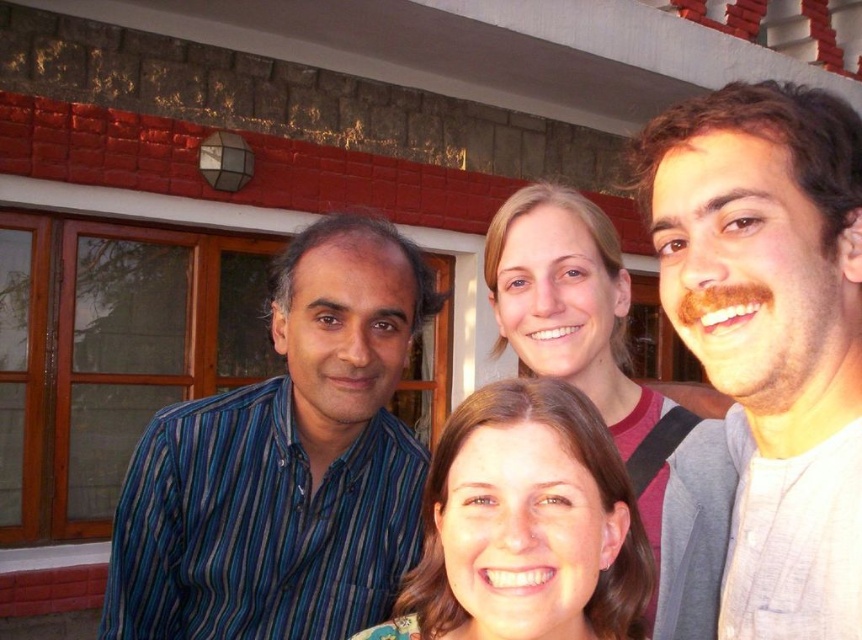
You are a photographer trying to adjust the focus on your camera. You want to ensure that both the blue striped shirt at left and the gray cotton shirt at right are in clear focus. Given their heights, which shirt should you focus on to ensure both are sharp?

The blue striped shirt at left is much taller than the gray cotton shirt at right. To ensure both are in focus, you should focus on the blue striped shirt at left since it is taller and likely further away, setting the focal point for the depth of field to cover both.

You are a photographer adjusting the camera focus. The gray cotton shirt at right and smooth blonde hair at center are two elements you want to capture clearly. Given that the camera can focus on objects within a 12 inch range, will both elements be in focus?

The distance between the gray cotton shirt at right and smooth blonde hair at center is 14.24 inches, which exceeds the camera focus range of 12 inches. Therefore, both elements cannot be in focus simultaneously.

You are standing at the camera position and want to take a photo of two points in the scene. The first point is at coordinates point [172,552] and the second point is at point [450,509]. Which point is closer to the camera?

Point [450,509] is closer to the camera because it is in front of point [172,552].